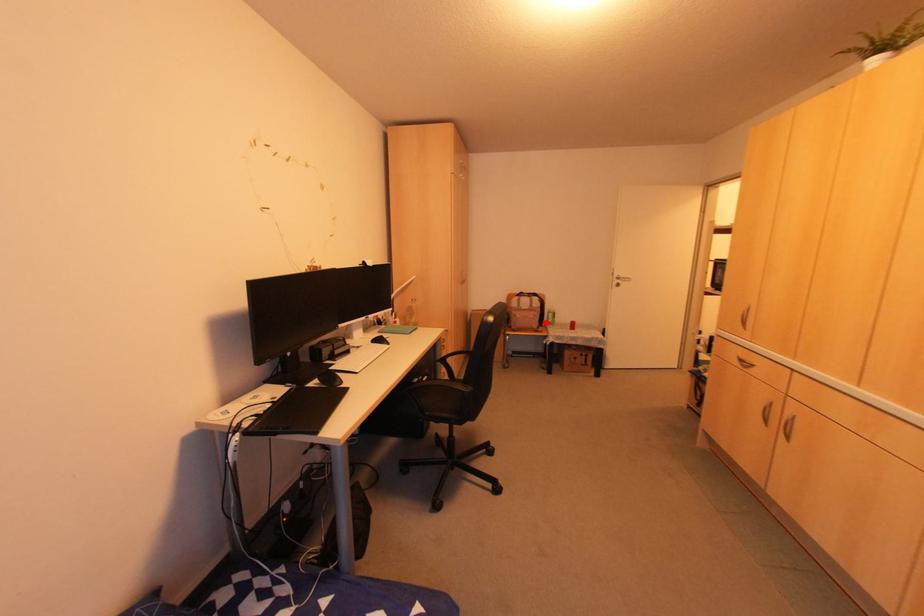
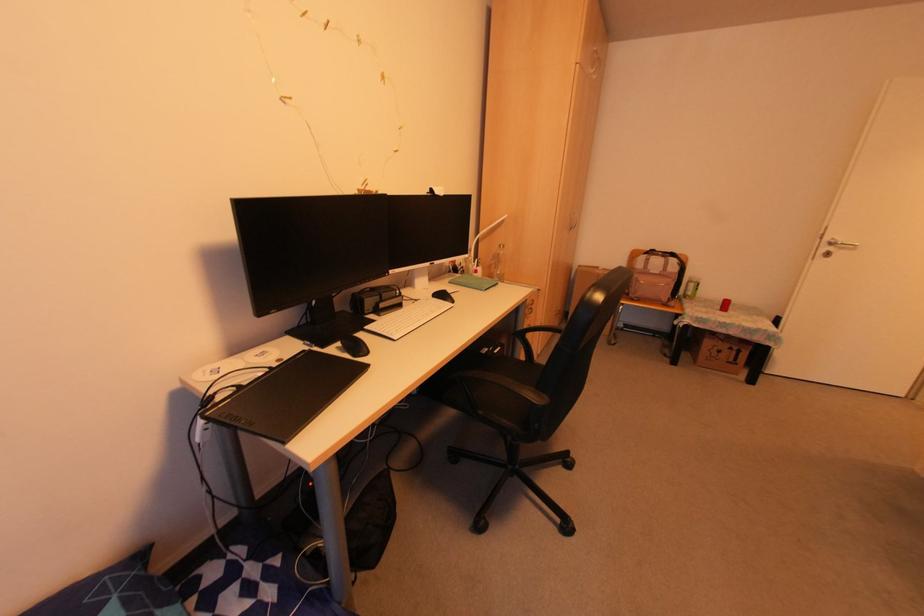
Question: I am providing you with two images of the same scene from different viewpoints. A red point is shown in image1. For the corresponding object point in image2, is it positioned nearer or farther from the camera?

Choices:
 (A) Nearer
 (B) Farther

Answer: (A)